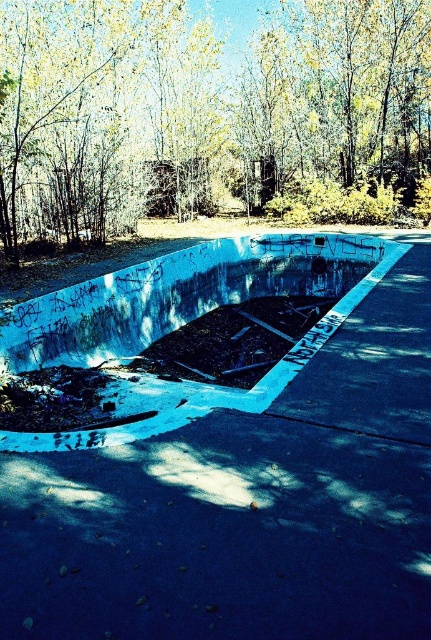
You are standing at point A and want to reach point B. The coordinates of point A are (380, 394) and point B are 0.293, 0.105. The path between them is 4.75 meters. If you can walk 1.5 meters per second, how long will it take you to walk from point A to point B?

The distance between point A and point B is 4.75 meters. At a walking speed of 1.5 meters per second, it will take approximately 3.17 seconds to walk from point A to point B.